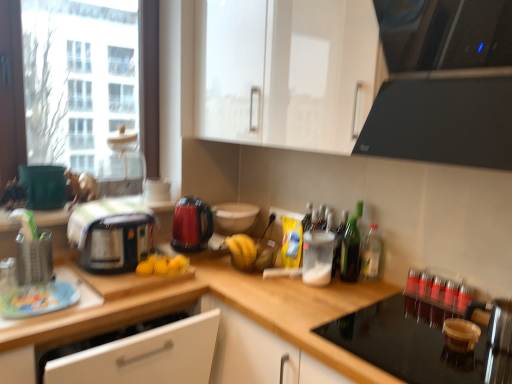
Where is `free space in front of green glass bottle at right, which is the 1th bottle in left-to-right order`? free space in front of green glass bottle at right, which is the 1th bottle in left-to-right order is located at coordinates (355, 299).